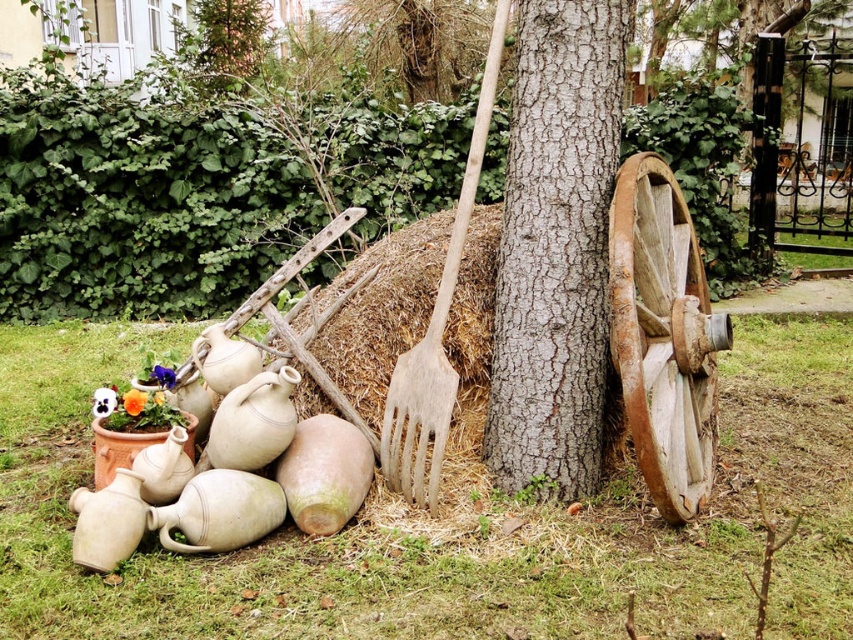
Between brown rough bark at center and orange matte flower at lower left, which one is positioned higher?

brown rough bark at center

Who is positioned more to the left, brown rough bark at center or orange matte flower at lower left?

From the viewer's perspective, orange matte flower at lower left appears more on the left side.

Locate an element on the screen. The image size is (853, 640). brown rough bark at center is located at coordinates (555, 248).

Where is `brown rough bark at center`? brown rough bark at center is located at coordinates (555, 248).

Is weathered wood wagon wheel at right smaller than wooden fork at center?

Actually, weathered wood wagon wheel at right might be larger than wooden fork at center.

Is weathered wood wagon wheel at right behind wooden fork at center?

That is False.

What do you see at coordinates (663, 333) in the screenshot?
I see `weathered wood wagon wheel at right` at bounding box center [663, 333].

Locate an element on the screen. weathered wood wagon wheel at right is located at coordinates (663, 333).

Can you confirm if brown textured tree trunk at center is positioned above purple matte flower at lower left?

Yes.

Which is above, brown textured tree trunk at center or purple matte flower at lower left?

Positioned higher is brown textured tree trunk at center.

This screenshot has height=640, width=853. What do you see at coordinates (419, 42) in the screenshot?
I see `brown textured tree trunk at center` at bounding box center [419, 42].

This screenshot has width=853, height=640. What are the coordinates of `brown textured tree trunk at center` in the screenshot? It's located at (419, 42).